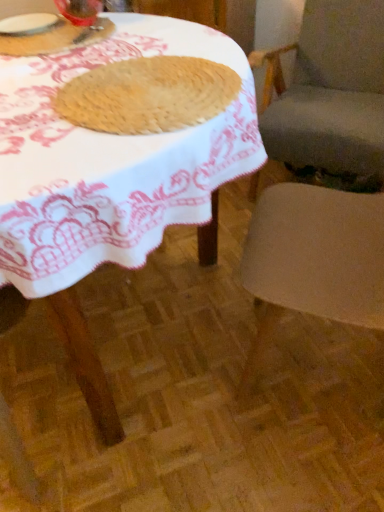
Locate an element on the screen. Image resolution: width=384 pixels, height=512 pixels. vacant area that is in front of matte glass jar at upper left is located at coordinates point(46,71).